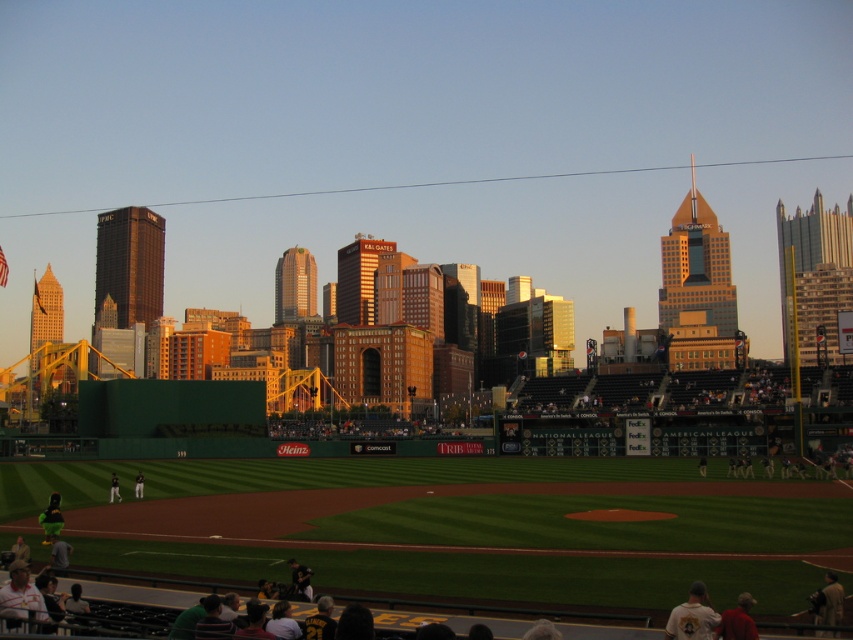
Question: Which point is closer to the camera taking this photo?

Choices:
 (A) (744, 609)
 (B) (136, 490)
 (C) (297, 566)

Answer: (A)

Question: From the image, what is the correct spatial relationship of dark blue shirt at lower center in relation to dark blue uniform at center?

Choices:
 (A) right
 (B) left

Answer: (A)

Question: Which of these objects is positioned farthest from the white jersey at lower right?

Choices:
 (A) red fabric shirt at lower right
 (B) dark blue shirt at lower center
 (C) dark gray uniform at center
 (D) dark blue uniform at center

Answer: (D)

Question: Is white jersey at lower right further to camera compared to dark blue shirt at lower center?

Choices:
 (A) yes
 (B) no

Answer: (B)

Question: Which of the following is the closest to the observer?

Choices:
 (A) white jersey at lower right
 (B) dark blue shirt at lower center

Answer: (A)

Question: Is dark blue shirt at lower center bigger than dark gray uniform at center?

Choices:
 (A) yes
 (B) no

Answer: (B)